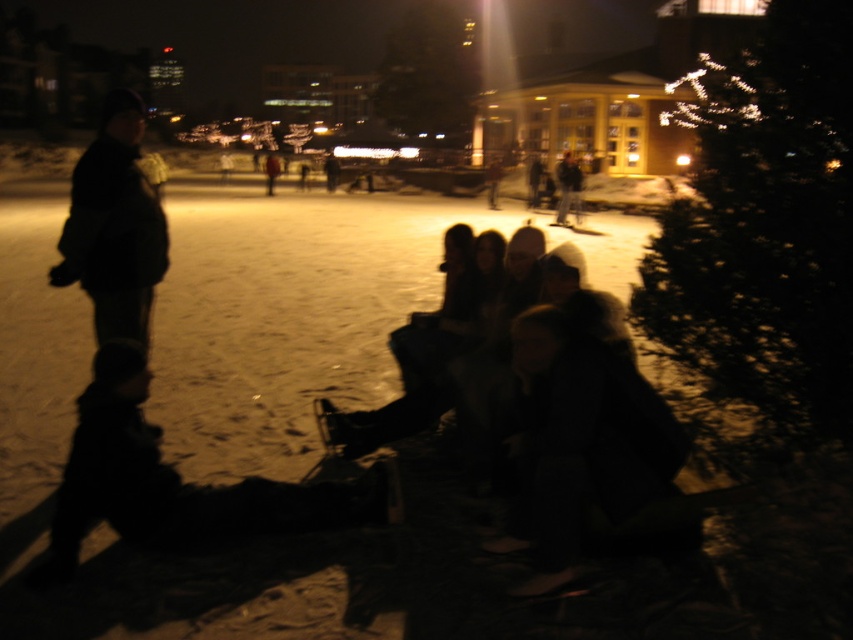
Question: Which of the following is the farthest from the observer?

Choices:
 (A) black fabric jacket at left
 (B) dark fabric jacket at lower left

Answer: (A)

Question: Considering the relative positions of dark fabric jacket at lower left and black fabric jacket at left in the image provided, where is dark fabric jacket at lower left located with respect to black fabric jacket at left?

Choices:
 (A) below
 (B) above

Answer: (A)

Question: Which object is the closest to the black fabric jacket at left?

Choices:
 (A) dark gray jacket at center
 (B) dark fabric jacket at lower left

Answer: (B)

Question: Which point appears closest to the camera in this image?

Choices:
 (A) (132, 468)
 (B) (129, 333)
 (C) (560, 209)

Answer: (A)

Question: Is black fabric jacket at left to the right of dark gray jacket at center from the viewer's perspective?

Choices:
 (A) no
 (B) yes

Answer: (A)

Question: Does dark fabric jacket at lower left appear on the right side of black fabric jacket at left?

Choices:
 (A) yes
 (B) no

Answer: (A)